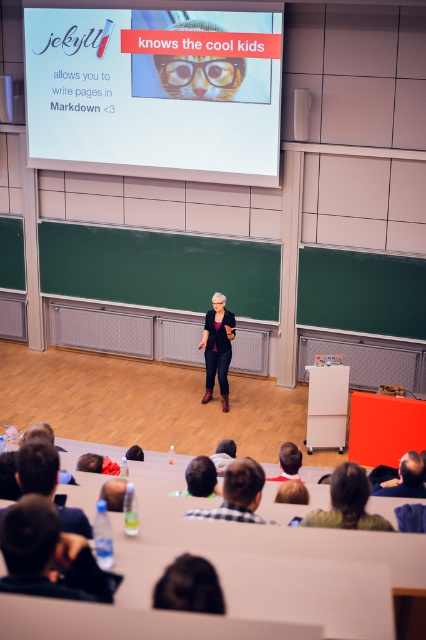
You are an attendee sitting in the front row of the lecture hall. You notice two jackets on the stage. Which one is positioned to the left when looking at the matte black blazer at center and the dark brown leather jacket at lower right?

The matte black blazer at center is positioned to the left of the dark brown leather jacket at lower right.

You are an attendee sitting in the front row of the lecture hall. You notice the black leather jacket at lower left and the white matte projection screen at upper center. Which object is closer to you?

The white matte projection screen at upper center is closer to you because the black leather jacket at lower left is behind it.

You are sitting in the audience and notice both the white matte projection screen at upper center and the black leather jacket at lower left in your line of sight. Which object is positioned to the left from your perspective?

The white matte projection screen at upper center is to the left of the black leather jacket at lower left from your perspective.